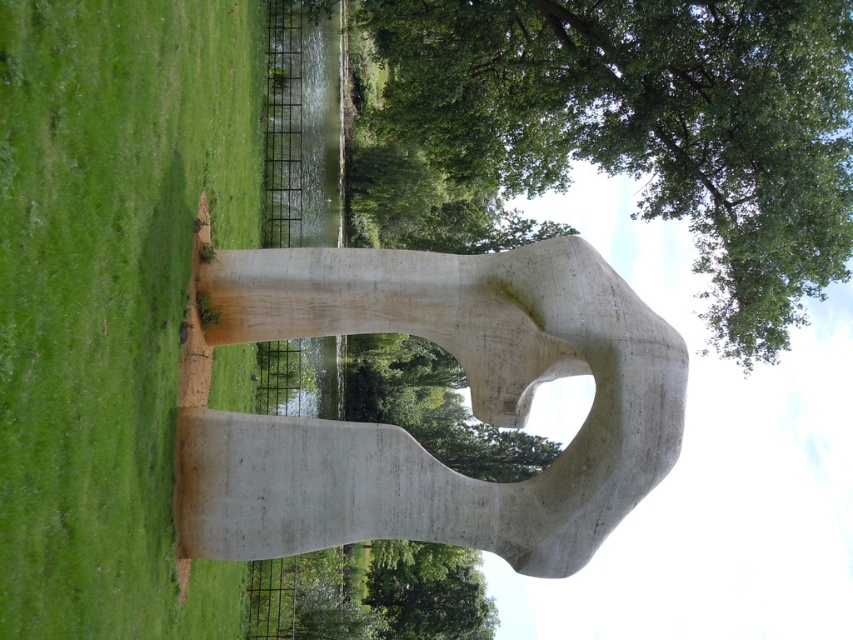
Based on the photo, is smooth concrete sculpture at center taller than green leafy tree at upper center?

No, smooth concrete sculpture at center is not taller than green leafy tree at upper center.

Can you confirm if smooth concrete sculpture at center is bigger than green leafy tree at upper center?

Actually, smooth concrete sculpture at center might be smaller than green leafy tree at upper center.

Locate an element on the screen. The height and width of the screenshot is (640, 853). smooth concrete sculpture at center is located at coordinates (471, 404).